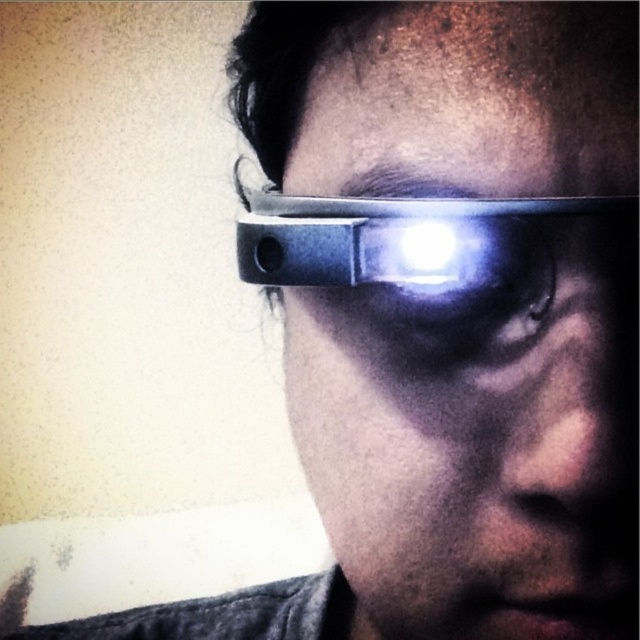
Question: Which of the following is the closest to the observer?

Choices:
 (A) (273, 209)
 (B) (401, 637)

Answer: (A)

Question: Is matte black glasses at center to the left of matte black headband at center from the viewer's perspective?

Choices:
 (A) yes
 (B) no

Answer: (B)

Question: Can you confirm if matte black glasses at center is positioned above matte black headband at center?

Choices:
 (A) yes
 (B) no

Answer: (B)

Question: Which of the following is the farthest from the observer?

Choices:
 (A) (304, 248)
 (B) (499, 77)

Answer: (A)

Question: Does matte black glasses at center have a larger size compared to matte black headband at center?

Choices:
 (A) no
 (B) yes

Answer: (B)